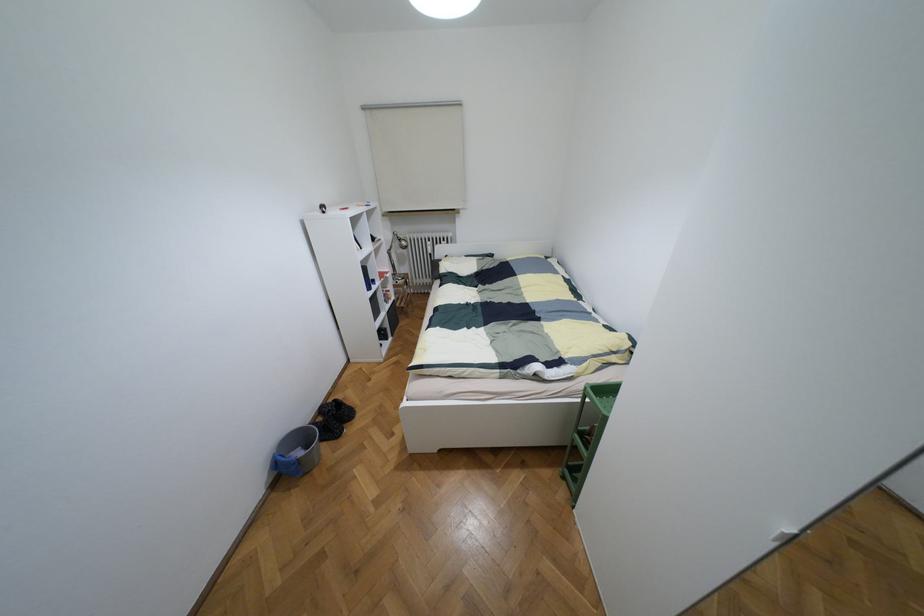
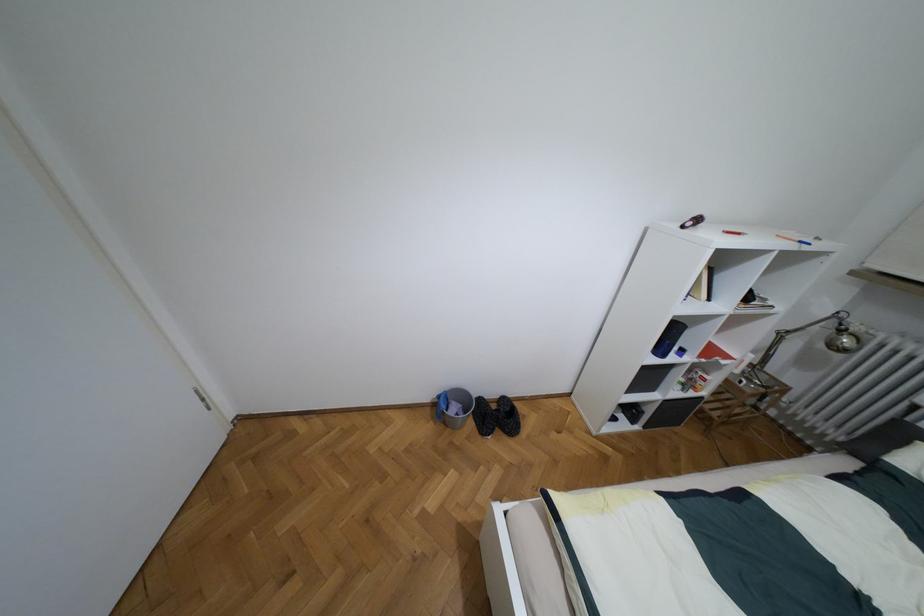
First-person continuous shooting, in which direction is the camera rotating?

The camera's rotation is toward left-down.